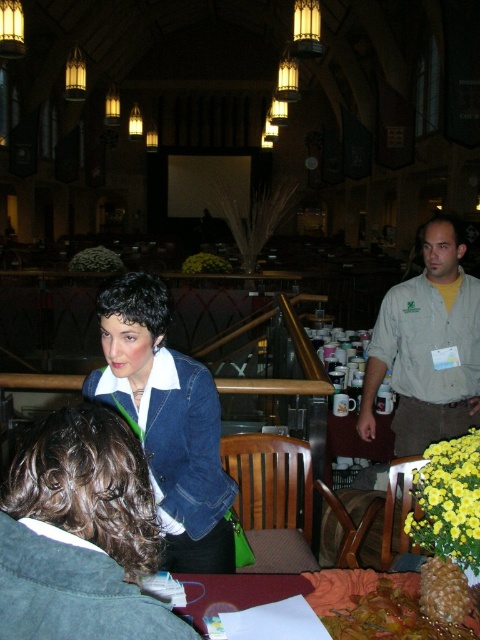
Question: Which is nearer to the denim jacket at center?

Choices:
 (A) khaki shirt at right
 (B) maroon fabric table at lower center

Answer: (B)

Question: Does khaki shirt at right appear on the right side of maroon fabric table at lower center?

Choices:
 (A) no
 (B) yes

Answer: (B)

Question: Can you confirm if denim jacket at center is wider than maroon fabric table at lower center?

Choices:
 (A) no
 (B) yes

Answer: (A)

Question: Does denim jacket at center have a smaller size compared to khaki shirt at right?

Choices:
 (A) yes
 (B) no

Answer: (A)

Question: Which object is positioned closest to the maroon fabric table at lower center?

Choices:
 (A) denim jacket at center
 (B) khaki shirt at right

Answer: (A)

Question: Which point appears farthest from the camera in this image?

Choices:
 (A) (109, 378)
 (B) (440, 241)
 (C) (235, 582)

Answer: (B)